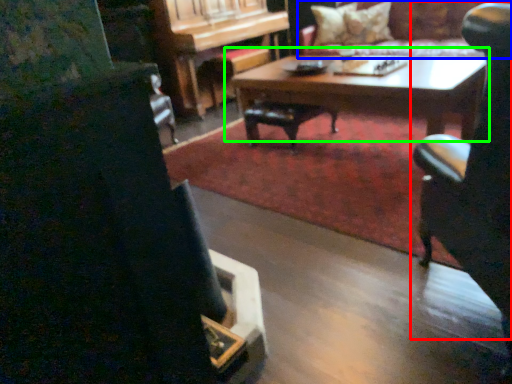
Question: Considering the real-world distances, which object is closest to chair (highlighted by a red box)? couch (highlighted by a blue box) or coffee table (highlighted by a green box).

Choices:
 (A) couch
 (B) coffee table

Answer: (B)